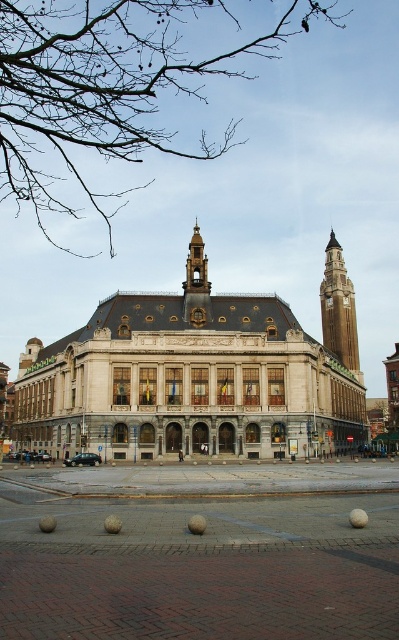
You are a tourist standing in front of the historic building. You notice the brick paving at center and the brown stone clock tower at upper right. Which object would you say occupies more space in the image?

The brick paving at center occupies more space in the image because it has a larger size compared to the brown stone clock tower at upper right.

You are a delivery person trying to park your van that is 2 meters wide. You see the brick paving at center and the beige stone building at center. Can you park your van between them?

The brick paving at center is thinner than beige stone building at center, so the space between them may not be wide enough for a 2 meter wide van. Check the actual width before attempting to park.

You are standing in front of the grand historic building and want to place a small decorative statue exactly at the center of the brick paving at center. According to the coordinates provided, where should you position the statue?

The brick paving at center is located at point (201, 552), so you should position the statue at those coordinates to place it exactly at the center of the brick paving at center.